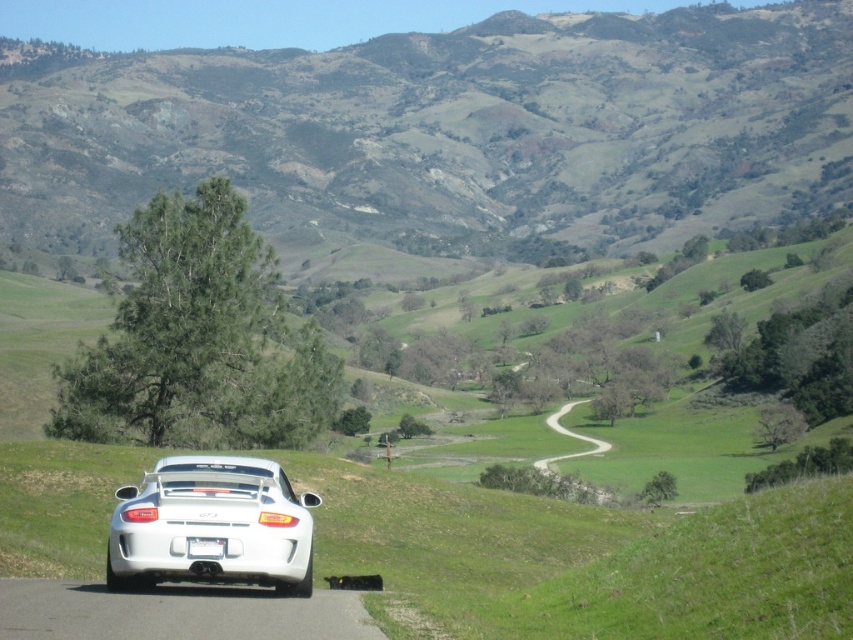
You are standing at the viewpoint of the image and want to reach the point marked at coordinates (412, 154). The paved road in front of you is 10 feet wide. If you decide to walk directly towards that point along the road, will you have enough space to walk without stepping off the road?

The point marked at coordinates (412, 154) is 1142.23 feet away from the viewer. Since the paved road is 10 feet wide, walking directly towards the point along the road will keep you within the road as long as the path remains straight. However, the question specifies walking directly towards the point, which is along the road. Therefore, you can walk towards the point without stepping off the road as the road provides sufficient width for passage.

You are driving a car and want to know if the gravel dirt road at center is wide enough to pass another vehicle coming from the opposite direction. Can you determine this by comparing it to the white plastic license plate at center?

The gravel dirt road at center is wider than the white plastic license plate at center, so it is likely wide enough to pass another vehicle safely.